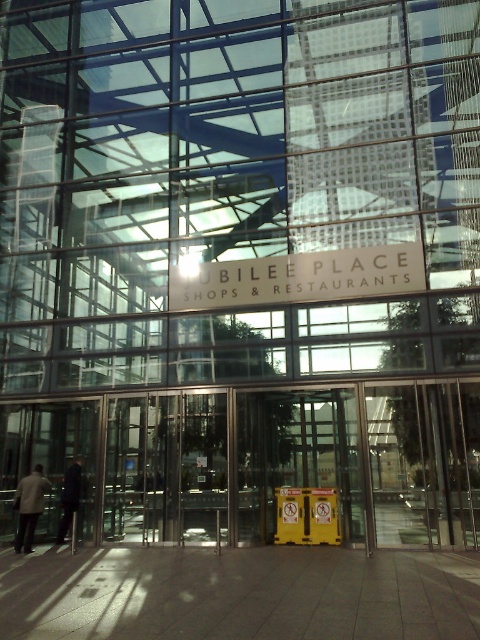
You are standing at the entrance of Jubilee Place and want to read the white matte sign at center. However, there is a light beige jacket at lower left in your way. Can you move around the jacket to still see the sign?

The white matte sign at center is in front of the light beige jacket at lower left, so the jacket is blocking your view. You need to move the jacket out of the way to see the sign clearly.

You are standing at the entrance of Jubilee Place and want to locate the white matte sign at center. Based on the coordinates provided in the Objects Description, can you determine its position relative to the entrance doors?

The white matte sign at center is located at coordinates point [298,276], which places it centrally positioned above the entrance doors, as the coordinates suggest it is at the center of the image.